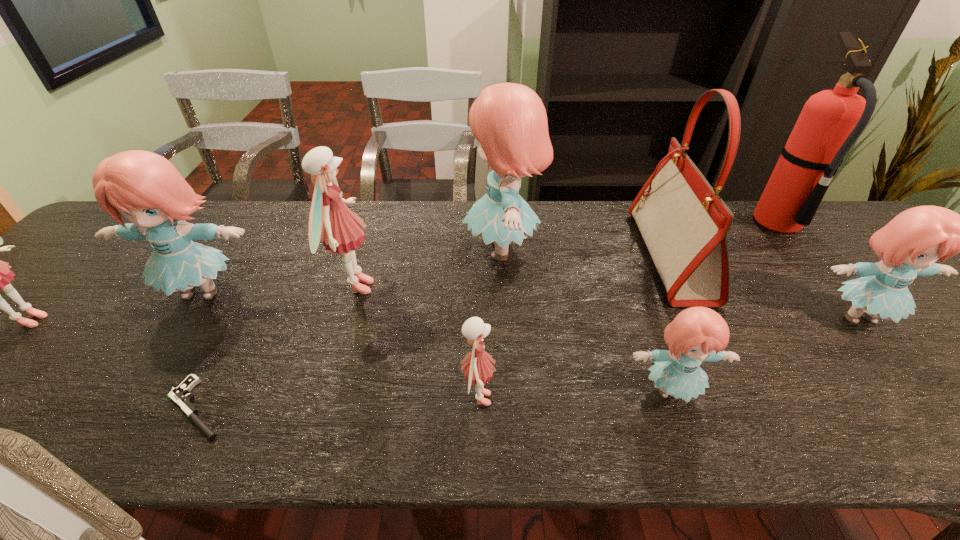
Where is `object that is the nearest to the fire extinguisher`? This screenshot has width=960, height=540. object that is the nearest to the fire extinguisher is located at coordinates (908, 246).

Find the location of a particular element. This screenshot has height=540, width=960. the fourth closest doll to the tallest doll is located at coordinates pyautogui.click(x=146, y=188).

Locate an element on the screen. This screenshot has width=960, height=540. doll that is the fourth closest to the smallest blue doll is located at coordinates (331, 221).

This screenshot has width=960, height=540. What are the coordinates of `blue doll object that ranks as the closest to the smallest blue doll` in the screenshot? It's located at (509, 120).

Choose which blue doll is the third nearest neighbor to the nearest pink doll. Please provide its 2D coordinates. Your answer should be formatted as a tuple, i.e. [(x, y)], where the tuple contains the x and y coordinates of a point satisfying the conditions above.

[(146, 188)]

This screenshot has width=960, height=540. I want to click on pink doll that is the closest to the second pink doll from right to left, so click(x=477, y=368).

Find the location of `pink doll that is the closest to the handbag`. pink doll that is the closest to the handbag is located at coordinates (477, 368).

You are a GUI agent. You are given a task and a screenshot of the screen. Output one action in this format:
    pyautogui.click(x=<x>, y=<y>)
    Task: Click on the vacant area that satisfies the following two spatial constraints: 1. on the front-facing side of the third biggest blue doll; 2. on the front-facing side of the smallest pink doll
    
    Given the screenshot: What is the action you would take?
    pyautogui.click(x=929, y=399)